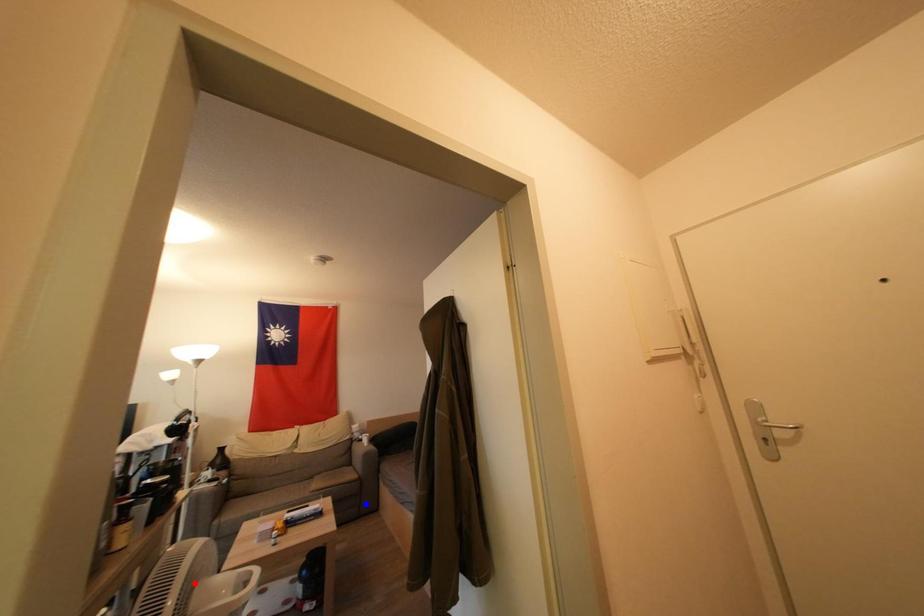
Question: Two points are marked on the image. Which point is closer to the camera?

Choices:
 (A) Blue point is closer.
 (B) Red point is closer.

Answer: (B)